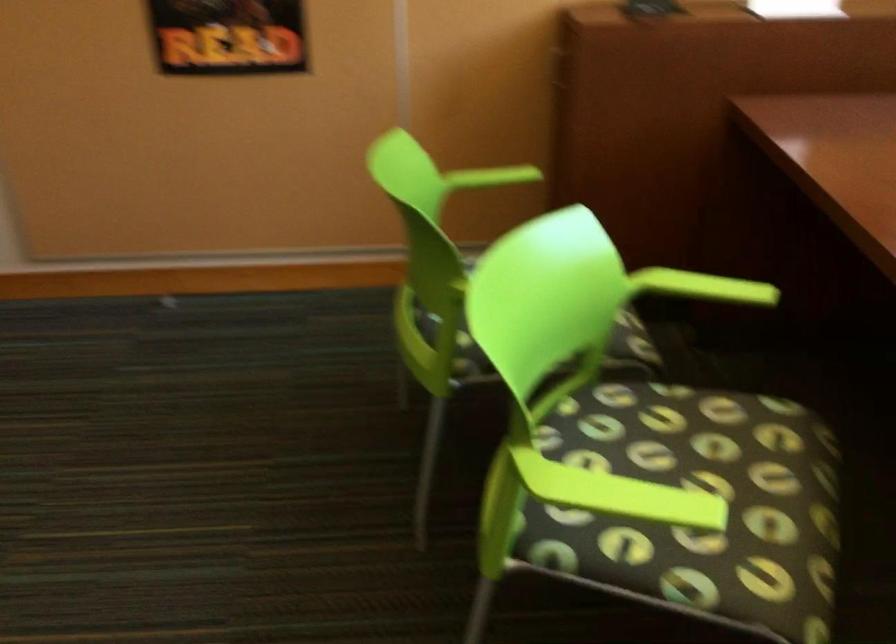
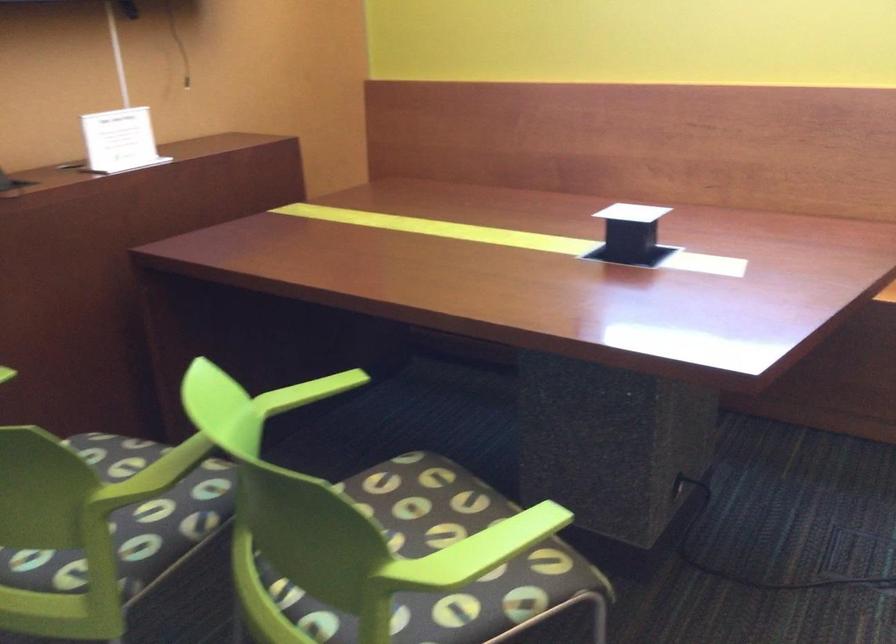
The point at (x=742, y=430) is marked in the first image. Where is the corresponding point in the second image?

(403, 487)